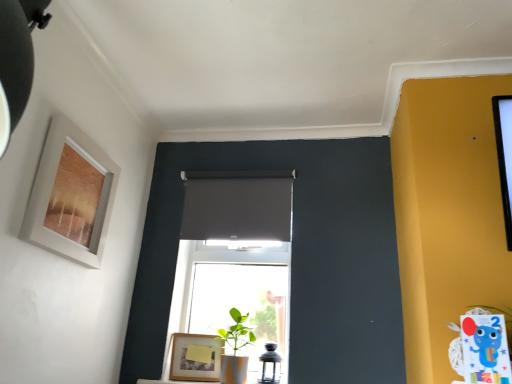
The width and height of the screenshot is (512, 384). Identify the location of free space above matte gray curtain at center (from a real-world perspective). 230,168.